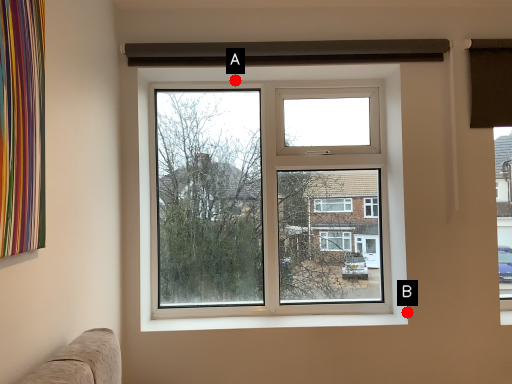
Question: Two points are circled on the image, labeled by A and B beside each circle. Which point appears closest to the camera in this image?

Choices:
 (A) A is closer
 (B) B is closer

Answer: (B)